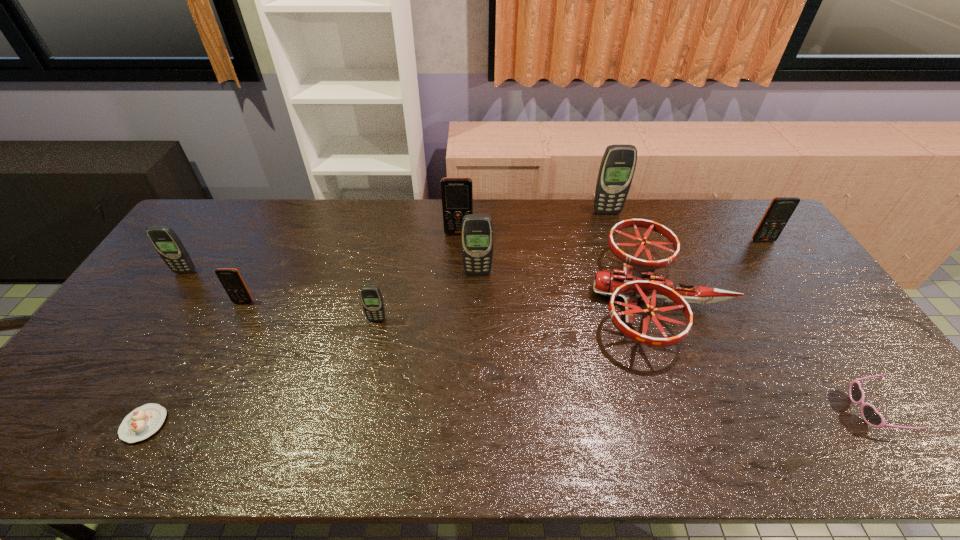
Image resolution: width=960 pixels, height=540 pixels. I want to click on blank space located on the screen of the second biggest gray cellular telephone, so click(x=477, y=374).

Where is `free space located 0.400m on the screen of the leftmost gray cellular telephone`? This screenshot has height=540, width=960. free space located 0.400m on the screen of the leftmost gray cellular telephone is located at coordinates (109, 384).

Locate an element on the screen. free point located 0.330m on the screen of the rightmost orange cellular telephone is located at coordinates (817, 317).

Identify the location of vacant space located on the screen of the second nearest cellular telephone. Image resolution: width=960 pixels, height=540 pixels. (222, 345).

Where is `vacant space located on the screen of the fourth object from left to right`? The image size is (960, 540). vacant space located on the screen of the fourth object from left to right is located at coordinates (372, 348).

At what (x,y) coordinates should I click in order to perform the action: click on vacant space located 0.170m on the left of the drone. Please return your answer as a coordinate pair (x, y). Looking at the image, I should click on (535, 298).

Identify the location of free space located on the front-facing side of the sunglasses. (832, 410).

Where is `free location located on the front-facing side of the sunglasses`? free location located on the front-facing side of the sunglasses is located at coordinates (787, 410).

Identify the location of free space located on the front-facing side of the sunglasses. This screenshot has height=540, width=960. (762, 410).

I want to click on free space located 0.140m on the back of the shortest object, so click(182, 357).